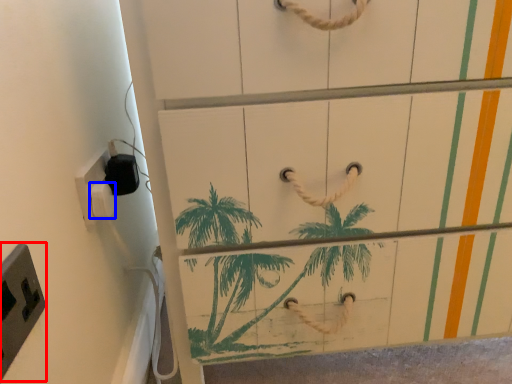
Question: Among these objects, which one is farthest to the camera, light switch (highlighted by a red box) or light switch (highlighted by a blue box)?

Choices:
 (A) light switch
 (B) light switch

Answer: (B)